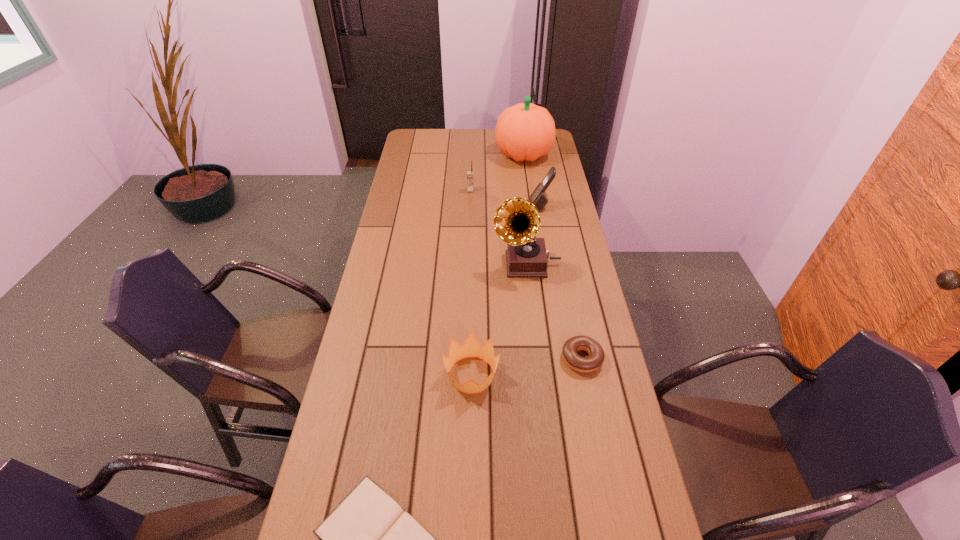
Where is `vacant space located from the horn of the phonograph record`? vacant space located from the horn of the phonograph record is located at coordinates (422, 264).

Where is `vacant space situated 0.300m from the horn of the phonograph record`? This screenshot has width=960, height=540. vacant space situated 0.300m from the horn of the phonograph record is located at coordinates (408, 264).

Find the location of `free space located 0.300m on the front-facing side of the nearer cellular telephone`. free space located 0.300m on the front-facing side of the nearer cellular telephone is located at coordinates (456, 206).

Where is `free space located 0.170m on the front-facing side of the nearer cellular telephone`? The width and height of the screenshot is (960, 540). free space located 0.170m on the front-facing side of the nearer cellular telephone is located at coordinates (488, 206).

Identify the location of free location located on the front-facing side of the nearer cellular telephone. The image size is (960, 540). (449, 206).

In order to click on vacant space located 0.210m on the front of the fourth tallest object, where the keypad is located in this screenshot , I will do `click(469, 222)`.

The image size is (960, 540). What are the coordinates of `blank area located 0.280m on the front of the crown` in the screenshot? It's located at (469, 511).

Locate an element on the screen. vacant space located 0.310m on the front of the doughnut is located at coordinates (609, 490).

Image resolution: width=960 pixels, height=540 pixels. What are the coordinates of `object that is at the far edge` in the screenshot? It's located at (524, 132).

The image size is (960, 540). What are the coordinates of `pumpkin that is at the right edge` in the screenshot? It's located at (524, 132).